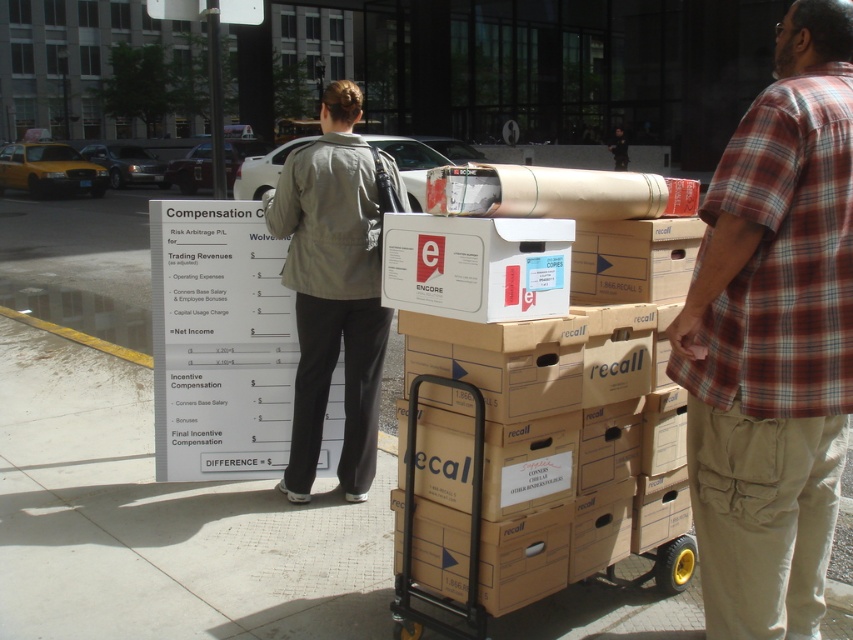
Question: Which point is farther from the camera taking this photo?

Choices:
 (A) (724, 342)
 (B) (299, 474)
 (C) (611, 152)
 (D) (560, 483)

Answer: (C)

Question: Can you confirm if plaid shirt at center is smaller than cardboard carton at center?

Choices:
 (A) no
 (B) yes

Answer: (B)

Question: Is cardboard carton at center below light gray jacket at center?

Choices:
 (A) no
 (B) yes

Answer: (B)

Question: Can you confirm if plaid shirt at center is positioned to the right of light gray jacket at center?

Choices:
 (A) yes
 (B) no

Answer: (A)

Question: Based on their relative distances, which object is nearer to the cardboard carton at center?

Choices:
 (A) light gray jacket at center
 (B) plaid cotton shirt at right
 (C) plaid shirt at center

Answer: (C)

Question: Which object is positioned farthest from the cardboard carton at center?

Choices:
 (A) light gray jacket at center
 (B) plaid shirt at center

Answer: (A)